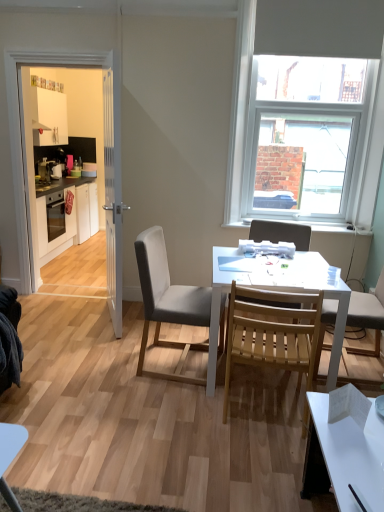
Question: Considering the relative sizes of metallic silver toaster at left and white glossy cabinets at left in the image provided, is metallic silver toaster at left thinner than white glossy cabinets at left?

Choices:
 (A) no
 (B) yes

Answer: (B)

Question: Does metallic silver toaster at left have a larger size compared to white glossy cabinets at left?

Choices:
 (A) yes
 (B) no

Answer: (B)

Question: Are metallic silver toaster at left and white glossy cabinets at left beside each other?

Choices:
 (A) yes
 (B) no

Answer: (B)

Question: Could you tell me if metallic silver toaster at left is turned towards white glossy cabinets at left?

Choices:
 (A) yes
 (B) no

Answer: (B)

Question: Is metallic silver toaster at left oriented away from white glossy cabinets at left?

Choices:
 (A) yes
 (B) no

Answer: (B)

Question: In terms of height, does velvet grey chair at center, the third chair positioned from the right, look taller or shorter compared to white wooden door at left?

Choices:
 (A) tall
 (B) short

Answer: (B)

Question: Choose the correct answer: Is velvet grey chair at center, the third chair positioned from the right, inside white wooden door at left or outside it?

Choices:
 (A) outside
 (B) inside

Answer: (A)

Question: In terms of size, does velvet grey chair at center, the third chair positioned from the right, appear bigger or smaller than white wooden door at left?

Choices:
 (A) big
 (B) small

Answer: (A)

Question: Is point (158, 328) positioned closer to the camera than point (119, 159)?

Choices:
 (A) closer
 (B) farther

Answer: (A)

Question: Is white matte table at center to the left or to the right of natural wood chair at center, the 2th chair when ordered from left to right, in the image?

Choices:
 (A) left
 (B) right

Answer: (B)

Question: Looking at the image, does white matte table at center seem bigger or smaller compared to natural wood chair at center, the 2th chair when ordered from left to right?

Choices:
 (A) big
 (B) small

Answer: (A)

Question: From a real-world perspective, relative to natural wood chair at center, positioned as the 2th chair in right-to-left order, is white matte table at center vertically above or below?

Choices:
 (A) above
 (B) below

Answer: (B)

Question: Is point 329,290 closer or farther from the camera than point 301,367?

Choices:
 (A) farther
 (B) closer

Answer: (B)

Question: Is white wooden door at left bigger or smaller than natural wood chair at center, positioned as the 2th chair in right-to-left order?

Choices:
 (A) big
 (B) small

Answer: (A)

Question: Is white wooden door at left to the left or to the right of natural wood chair at center, the 2th chair when ordered from left to right, in the image?

Choices:
 (A) left
 (B) right

Answer: (A)